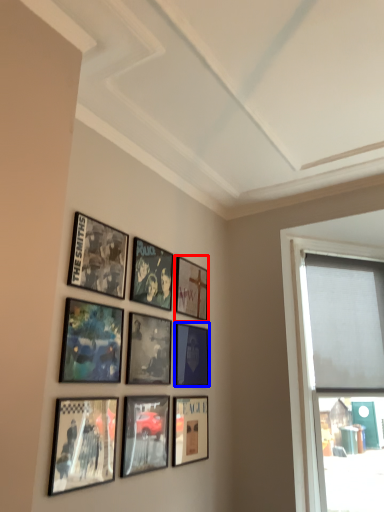
Question: Which object is further to the camera taking this photo, picture frame (highlighted by a red box) or picture frame (highlighted by a blue box)?

Choices:
 (A) picture frame
 (B) picture frame

Answer: (A)